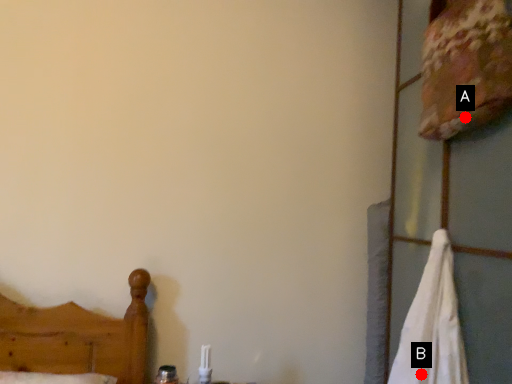
Question: Two points are circled on the image, labeled by A and B beside each circle. Which point appears closest to the camera in this image?

Choices:
 (A) A is closer
 (B) B is closer

Answer: (A)